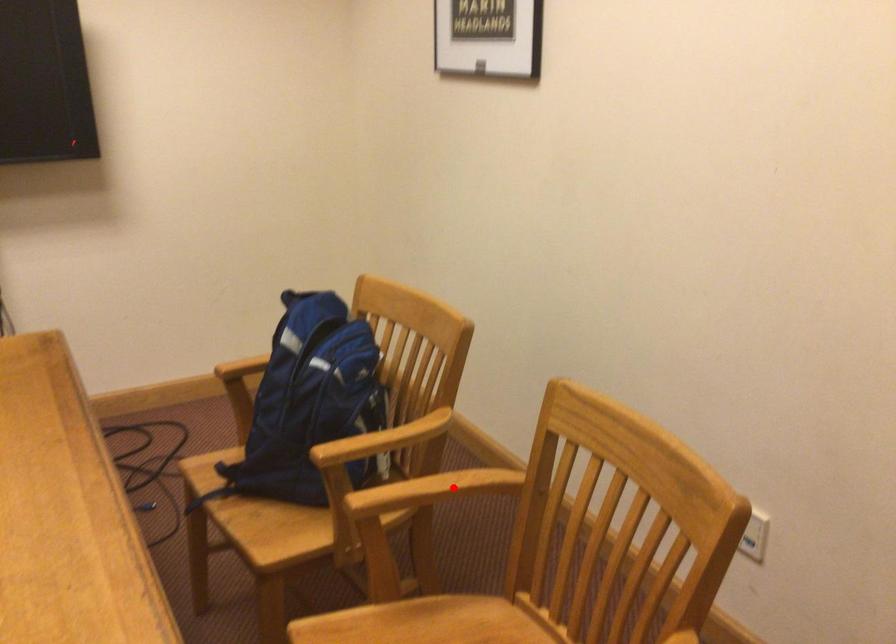
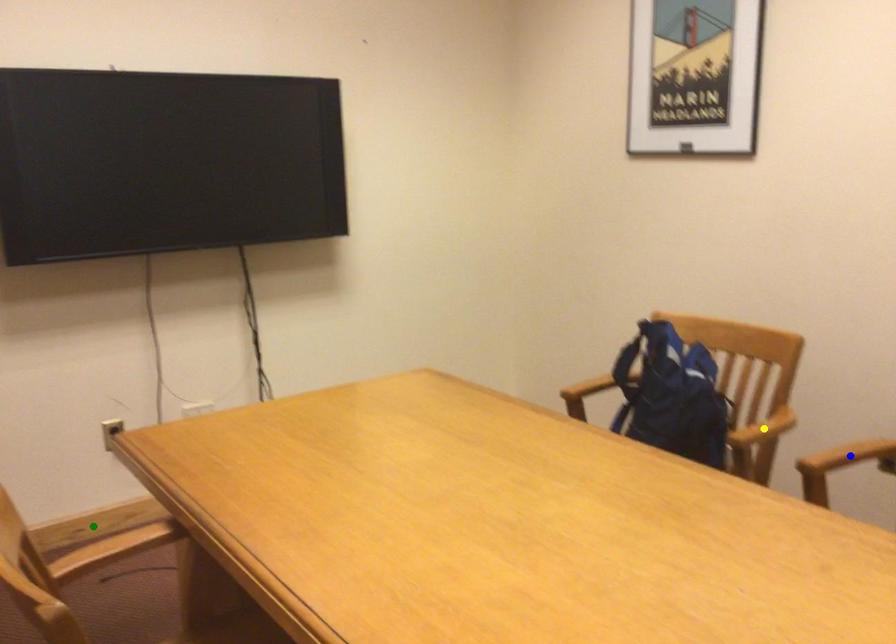
Question: I am providing you with two images of the same scene from different viewpoints. A red point is marked on the first image. You are given multiple points on the second image. Which point in image 2 is actually the same real-world point as the red point in image 1?

Choices:
 (A) yellow point
 (B) green point
 (C) blue point

Answer: (C)